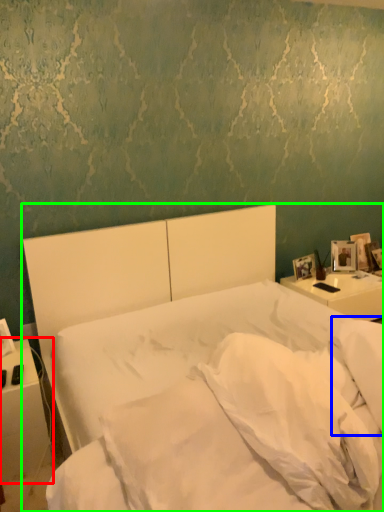
Question: Which object is positioned closest to nightstand (highlighted by a red box)? Select from pillow (highlighted by a blue box) and bed (highlighted by a green box).

Choices:
 (A) pillow
 (B) bed

Answer: (B)